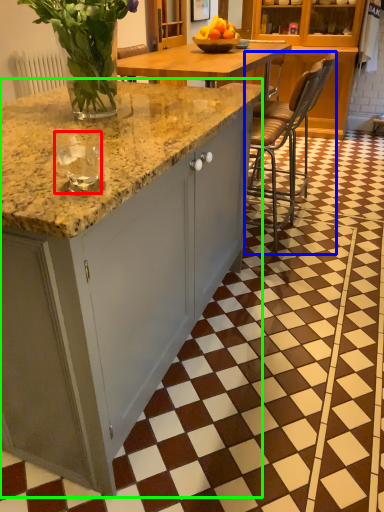
Question: Which is nearer to the wine glass (highlighted by a red box)? chair (highlighted by a blue box) or cabinetry (highlighted by a green box).

Choices:
 (A) chair
 (B) cabinetry

Answer: (B)